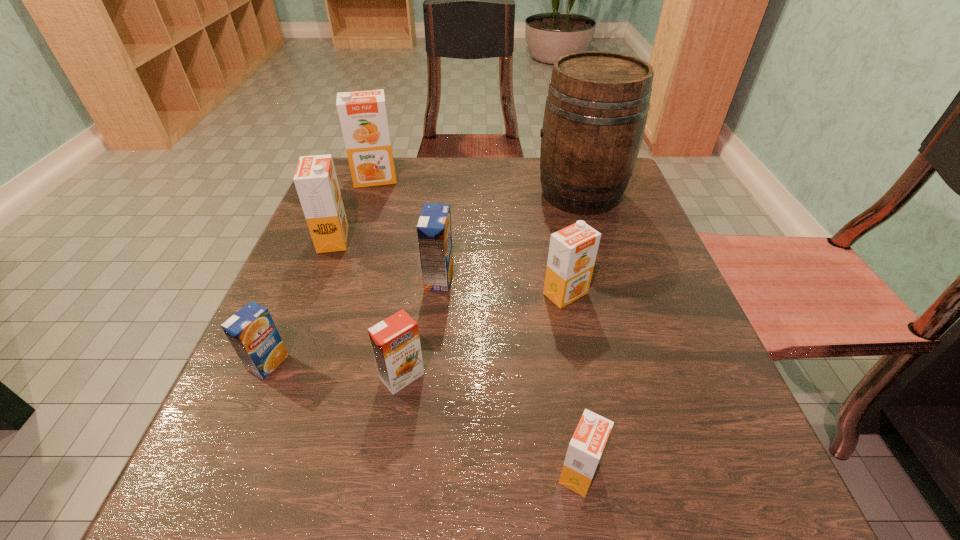
Locate an element on the screen. This screenshot has height=540, width=960. vacant space that is in between the farther blue orange_juice and the second tallest orange juice is located at coordinates (386, 259).

This screenshot has width=960, height=540. I want to click on blank region between the third biggest orange orange juice and the farther blue orange_juice, so click(x=502, y=286).

Find the location of a particular element. The width and height of the screenshot is (960, 540). free space between the bigger blue orange_juice and the second tallest orange juice is located at coordinates tap(386, 259).

Find the location of a particular element. free space between the nearer blue orange_juice and the second farthest orange orange juice is located at coordinates (300, 301).

Locate an element on the screen. The height and width of the screenshot is (540, 960). free spot between the second biggest orange orange juice and the farther blue orange_juice is located at coordinates (386, 259).

Identify the location of the fourth closest object to the second nearest orange orange juice. This screenshot has width=960, height=540. (572, 253).

Identify which object is the third closest to the cider. Please provide its 2D coordinates. Your answer should be formatted as a tuple, i.e. [(x, y)], where the tuple contains the x and y coordinates of a point satisfying the conditions above.

[(363, 117)]

Choose which orange juice is the third nearest neighbor to the tallest object. Please provide its 2D coordinates. Your answer should be formatted as a tuple, i.e. [(x, y)], where the tuple contains the x and y coordinates of a point satisfying the conditions above.

[(363, 117)]

Identify the location of orange juice that stands as the fifth closest to the left blue orange_juice. Image resolution: width=960 pixels, height=540 pixels. (572, 253).

The image size is (960, 540). What are the coordinates of `orange orange juice that is the second nearest to the farther blue orange_juice` in the screenshot? It's located at (572, 253).